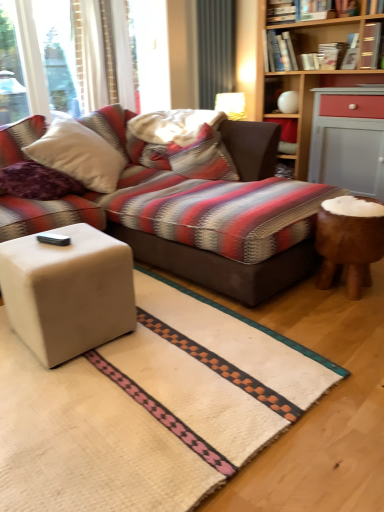
Question: Is striped fabric pillow at center, the second pillow from the left, wider than purple soft pillow at left, arranged as the 1th pillow when viewed from the left?

Choices:
 (A) no
 (B) yes

Answer: (B)

Question: From a real-world perspective, does striped fabric pillow at center, the 2th pillow positioned from the front, sit lower than purple soft pillow at left, acting as the second pillow starting from the right?

Choices:
 (A) yes
 (B) no

Answer: (B)

Question: Is striped fabric pillow at center, which is the 1th pillow in back-to-front order, taller than purple soft pillow at left, the 2th pillow in the back-to-front sequence?

Choices:
 (A) yes
 (B) no

Answer: (A)

Question: Considering the relative sizes of striped fabric pillow at center, the first pillow when ordered from right to left, and purple soft pillow at left, acting as the second pillow starting from the right, in the image provided, is striped fabric pillow at center, the first pillow when ordered from right to left, smaller than purple soft pillow at left, acting as the second pillow starting from the right,?

Choices:
 (A) yes
 (B) no

Answer: (B)

Question: Is striped fabric pillow at center, which is the 1th pillow in back-to-front order, far away from purple soft pillow at left, the 2th pillow in the back-to-front sequence?

Choices:
 (A) yes
 (B) no

Answer: (B)

Question: From the image's perspective, is striped fabric pillow at center, the 2th pillow positioned from the front, on purple soft pillow at left, the 2th pillow in the back-to-front sequence?

Choices:
 (A) yes
 (B) no

Answer: (A)

Question: Does hardcover book at upper center, which is counted as the 3th book, starting from the left, lie in front of purple soft pillow at left, acting as the first pillow starting from the front?

Choices:
 (A) yes
 (B) no

Answer: (B)

Question: Is purple soft pillow at left, acting as the second pillow starting from the right, inside hardcover book at upper center, positioned as the fifth book in right-to-left order?

Choices:
 (A) no
 (B) yes

Answer: (A)

Question: Is hardcover book at upper center, which is counted as the 3th book, starting from the left, looking in the opposite direction of purple soft pillow at left, arranged as the 1th pillow when viewed from the left?

Choices:
 (A) yes
 (B) no

Answer: (B)

Question: Is hardcover book at upper center, which is counted as the 3th book, starting from the left, further to the viewer compared to purple soft pillow at left, acting as the first pillow starting from the front?

Choices:
 (A) yes
 (B) no

Answer: (A)

Question: Are hardcover book at upper center, which is counted as the 3th book, starting from the left, and purple soft pillow at left, the 2th pillow in the back-to-front sequence, making contact?

Choices:
 (A) yes
 (B) no

Answer: (B)

Question: Considering the relative sizes of hardcover book at upper center, which is counted as the 3th book, starting from the left, and purple soft pillow at left, acting as the second pillow starting from the right, in the image provided, is hardcover book at upper center, which is counted as the 3th book, starting from the left, smaller than purple soft pillow at left, acting as the second pillow starting from the right,?

Choices:
 (A) yes
 (B) no

Answer: (A)

Question: Does hardcover book at upper right, positioned as the 5th book in left-to-right order, lie in front of hardcover book at upper right, which is the 6th book from left to right?

Choices:
 (A) no
 (B) yes

Answer: (A)